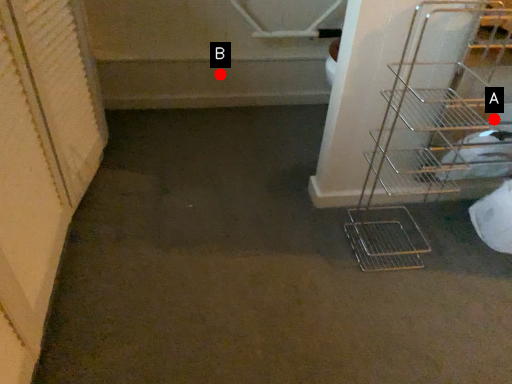
Question: Two points are circled on the image, labeled by A and B beside each circle. Among these points, which one is farthest from the camera?

Choices:
 (A) A is further
 (B) B is further

Answer: (B)